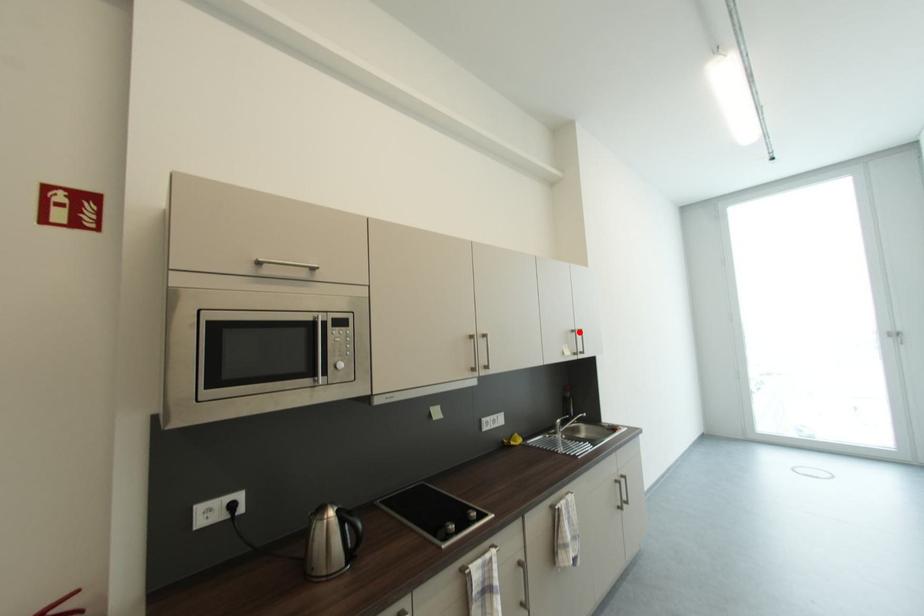
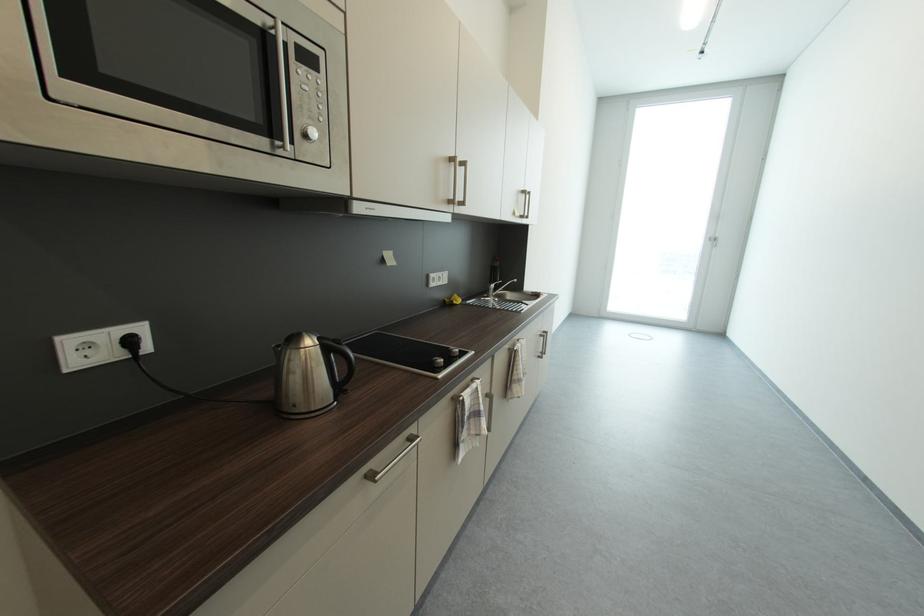
Find the pixel in the second image that matches the highlighted location in the first image.

(529, 193)